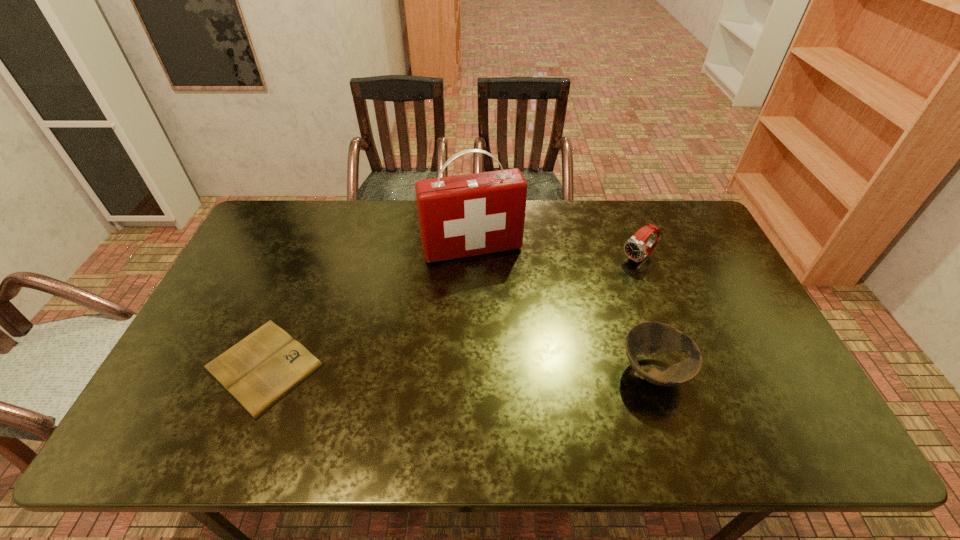
Locate an element on the screen. This screenshot has width=960, height=540. vacant area situated 0.050m on the front face of the first-aid kit is located at coordinates (488, 275).

This screenshot has width=960, height=540. In order to click on free space located on the face of the third shortest object in this screenshot , I will do `click(534, 327)`.

Image resolution: width=960 pixels, height=540 pixels. In order to click on free space located on the face of the third shortest object in this screenshot , I will do `click(579, 298)`.

I want to click on vacant region located on the face of the third shortest object, so click(616, 273).

Where is `object present at the far edge`? object present at the far edge is located at coordinates (473, 214).

Identify the location of book that is positioned at the near edge. This screenshot has height=540, width=960. (257, 372).

Where is `bowl that is positioned at the near edge`? Image resolution: width=960 pixels, height=540 pixels. bowl that is positioned at the near edge is located at coordinates (645, 338).

Identify the location of object at the left edge. (257, 372).

Identify the location of object that is at the near left corner. (257, 372).

Identify the location of free location at the far edge. (525, 221).